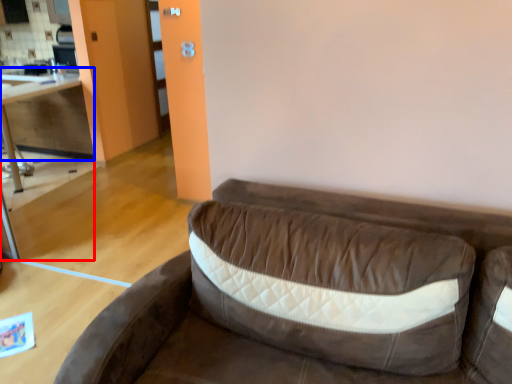
Question: Which object appears farthest to the camera in this image, table (highlighted by a red box) or cabinetry (highlighted by a blue box)?

Choices:
 (A) table
 (B) cabinetry

Answer: (B)